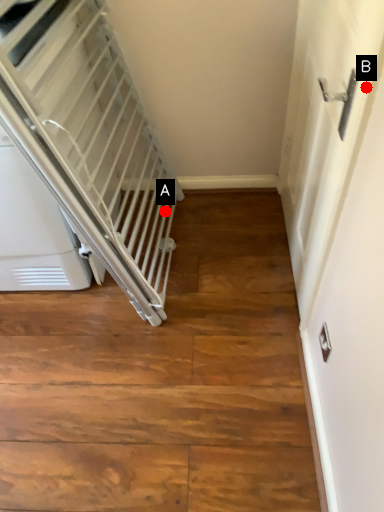
Question: Two points are circled on the image, labeled by A and B beside each circle. Which point appears closest to the camera in this image?

Choices:
 (A) A is closer
 (B) B is closer

Answer: (B)